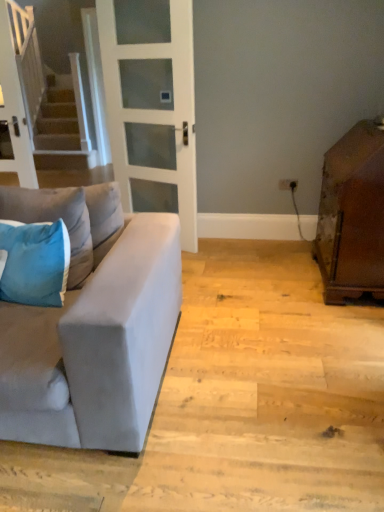
Where is `white frosted glass door at center`? This screenshot has width=384, height=512. white frosted glass door at center is located at coordinates (152, 105).

In order to face brown wooden cabinet at right, should I rotate leftwards or rightwards?

You should rotate right by 21.409 degrees.

The image size is (384, 512). Find the location of `blue velvet pillow at left, arranged as the 1th pillow when viewed from the top`. blue velvet pillow at left, arranged as the 1th pillow when viewed from the top is located at coordinates (55, 220).

From a real-world perspective, is suede gray couch at left under brown wooden cabinet at right?

Yes.

From the image's perspective, would you say suede gray couch at left is shown under brown wooden cabinet at right?

Yes, from the image's perspective, suede gray couch at left is beneath brown wooden cabinet at right.

Measure the distance between suede gray couch at left and brown wooden cabinet at right.

suede gray couch at left is 4.42 feet away from brown wooden cabinet at right.

Can you confirm if suede gray couch at left is positioned to the right of brown wooden cabinet at right?

Incorrect, suede gray couch at left is not on the right side of brown wooden cabinet at right.

Does blue velvet pillow at left, which is the second pillow from bottom to top, have a greater width compared to white frosted glass door at center?

Yes, blue velvet pillow at left, which is the second pillow from bottom to top, is wider than white frosted glass door at center.

Does blue velvet pillow at left, arranged as the 1th pillow when viewed from the top, have a smaller size compared to white frosted glass door at center?

Yes, blue velvet pillow at left, arranged as the 1th pillow when viewed from the top, is smaller than white frosted glass door at center.

Is blue velvet pillow at left, which is the second pillow from bottom to top, further to the viewer compared to white frosted glass door at center?

No, blue velvet pillow at left, which is the second pillow from bottom to top, is closer to the viewer.

From a real-world perspective, is blue velvet pillow at left, which is the second pillow from bottom to top, over white frosted glass door at center?

No.

Where is `studio couch on the right of blue velvet pillow at left, which is the second pillow from bottom to top`? This screenshot has height=512, width=384. studio couch on the right of blue velvet pillow at left, which is the second pillow from bottom to top is located at coordinates (92, 329).

Based on the photo, does suede gray couch at left turn towards blue velvet pillow at left, which is the second pillow from bottom to top?

Yes, suede gray couch at left is aimed at blue velvet pillow at left, which is the second pillow from bottom to top.

Which object is wider, suede gray couch at left or blue velvet pillow at left, which is the second pillow from bottom to top?

suede gray couch at left is wider.

Is blue fabric pillow at left, placed as the 2th pillow when sorted from top to bottom, next to brown wooden cabinet at right and touching it?

blue fabric pillow at left, placed as the 2th pillow when sorted from top to bottom, is not next to brown wooden cabinet at right, and they're not touching.

Considering the positions of objects blue fabric pillow at left, placed as the 2th pillow when sorted from top to bottom, and brown wooden cabinet at right in the image provided, who is in front, blue fabric pillow at left, placed as the 2th pillow when sorted from top to bottom, or brown wooden cabinet at right?

Positioned in front is blue fabric pillow at left, placed as the 2th pillow when sorted from top to bottom.

Would you say blue fabric pillow at left, placed as the 2th pillow when sorted from top to bottom, is to the left or to the right of brown wooden cabinet at right in the picture?

Based on their positions, blue fabric pillow at left, placed as the 2th pillow when sorted from top to bottom, is located to the left of brown wooden cabinet at right.

Is brown wooden cabinet at right in front of or behind blue fabric pillow at left, placed as the 2th pillow when sorted from top to bottom, in the image?

Visually, brown wooden cabinet at right is located behind blue fabric pillow at left, placed as the 2th pillow when sorted from top to bottom.

Between brown wooden cabinet at right and blue fabric pillow at left, placed as the 2th pillow when sorted from top to bottom, which one appears on the right side from the viewer's perspective?

Positioned to the right is brown wooden cabinet at right.

From a real-world perspective, who is located higher, brown wooden cabinet at right or blue fabric pillow at left, placed as the 2th pillow when sorted from top to bottom?

blue fabric pillow at left, placed as the 2th pillow when sorted from top to bottom, is physically above.

Is blue velvet pillow at left, arranged as the 1th pillow when viewed from the top, oriented towards brown wooden cabinet at right?

No, blue velvet pillow at left, arranged as the 1th pillow when viewed from the top, is not turned towards brown wooden cabinet at right.

Identify the location of cabinetry located above the blue velvet pillow at left, which is the second pillow from bottom to top (from the image's perspective). The width and height of the screenshot is (384, 512). (352, 215).

Is blue velvet pillow at left, arranged as the 1th pillow when viewed from the top, positioned before brown wooden cabinet at right?

Yes, blue velvet pillow at left, arranged as the 1th pillow when viewed from the top, is closer to the viewer.

Is blue velvet pillow at left, which is the second pillow from bottom to top, beside brown wooden cabinet at right?

No, blue velvet pillow at left, which is the second pillow from bottom to top, is not touching brown wooden cabinet at right.

Can you confirm if blue fabric pillow at left, placed as the 2th pillow when sorted from top to bottom, is positioned to the right of white frosted glass door at center?

Incorrect, blue fabric pillow at left, placed as the 2th pillow when sorted from top to bottom, is not on the right side of white frosted glass door at center.

From the image's perspective, is blue fabric pillow at left, the first pillow in the bottom-to-top sequence, located above or below white frosted glass door at center?

blue fabric pillow at left, the first pillow in the bottom-to-top sequence, is situated lower than white frosted glass door at center in the image.

Relative to white frosted glass door at center, is blue fabric pillow at left, the first pillow in the bottom-to-top sequence, in front or behind?

blue fabric pillow at left, the first pillow in the bottom-to-top sequence, is positioned closer to the viewer than white frosted glass door at center.

From a real-world perspective, which object stands above the other?

white frosted glass door at center.

Identify the location of cabinetry above the suede gray couch at left (from a real-world perspective). The height and width of the screenshot is (512, 384). (352, 215).

Image resolution: width=384 pixels, height=512 pixels. Find the location of `pillow that is the 1st object located in front of the white frosted glass door at center`. pillow that is the 1st object located in front of the white frosted glass door at center is located at coordinates (55, 220).

Which object lies further to the anchor point white frosted glass door at center, blue velvet pillow at left, arranged as the 1th pillow when viewed from the top, or suede gray couch at left?

Based on the image, suede gray couch at left appears to be further to white frosted glass door at center.

Based on their spatial positions, is blue velvet pillow at left, which is the second pillow from bottom to top, or white frosted glass door at center further from suede gray couch at left?

The object further to suede gray couch at left is white frosted glass door at center.

Which object lies further to the anchor point white frosted glass door at center, blue velvet pillow at left, arranged as the 1th pillow when viewed from the top, or blue fabric pillow at left, placed as the 2th pillow when sorted from top to bottom?

Based on the image, blue fabric pillow at left, placed as the 2th pillow when sorted from top to bottom, appears to be further to white frosted glass door at center.

Which object lies nearer to the anchor point brown wooden cabinet at right, suede gray couch at left or white frosted glass door at center?

white frosted glass door at center.

Looking at the image, which one is located closer to blue fabric pillow at left, the first pillow in the bottom-to-top sequence, blue velvet pillow at left, arranged as the 1th pillow when viewed from the top, or suede gray couch at left?

blue velvet pillow at left, arranged as the 1th pillow when viewed from the top, is positioned closer to the anchor blue fabric pillow at left, the first pillow in the bottom-to-top sequence.

Based on their spatial positions, is suede gray couch at left or blue velvet pillow at left, which is the second pillow from bottom to top, closer to white frosted glass door at center?

Among the two, blue velvet pillow at left, which is the second pillow from bottom to top, is located nearer to white frosted glass door at center.

Considering their positions, is suede gray couch at left positioned further to blue fabric pillow at left, the first pillow in the bottom-to-top sequence, than white frosted glass door at center?

white frosted glass door at center is further to blue fabric pillow at left, the first pillow in the bottom-to-top sequence.

Looking at the image, which one is located further to blue fabric pillow at left, the first pillow in the bottom-to-top sequence, suede gray couch at left or brown wooden cabinet at right?

brown wooden cabinet at right is further to blue fabric pillow at left, the first pillow in the bottom-to-top sequence.

I want to click on studio couch located between blue fabric pillow at left, placed as the 2th pillow when sorted from top to bottom, and brown wooden cabinet at right in the left-right direction, so click(92, 329).

Identify the location of pillow between white frosted glass door at center and blue fabric pillow at left, the first pillow in the bottom-to-top sequence, in the up-down direction. Image resolution: width=384 pixels, height=512 pixels. (55, 220).

Locate an element on the screen. Image resolution: width=384 pixels, height=512 pixels. pillow between blue fabric pillow at left, the first pillow in the bottom-to-top sequence, and brown wooden cabinet at right is located at coordinates (55, 220).

You are a GUI agent. You are given a task and a screenshot of the screen. Output one action in this format:
    pyautogui.click(x=<x>, y=<y>)
    Task: Click on the studio couch between blue velvet pillow at left, arranged as the 1th pillow when viewed from the top, and brown wooden cabinet at right from left to right
    The width and height of the screenshot is (384, 512).
    Given the screenshot: What is the action you would take?
    pyautogui.click(x=92, y=329)